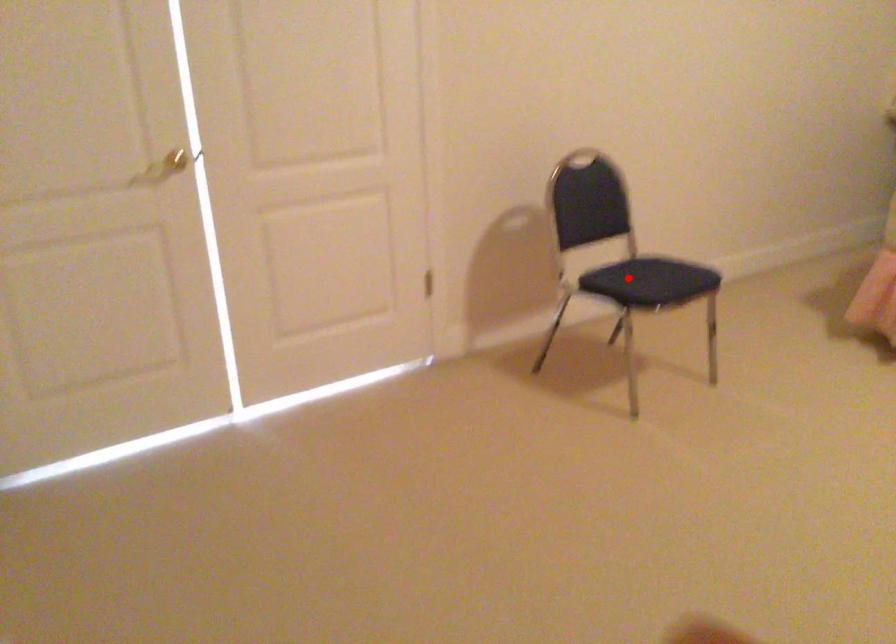
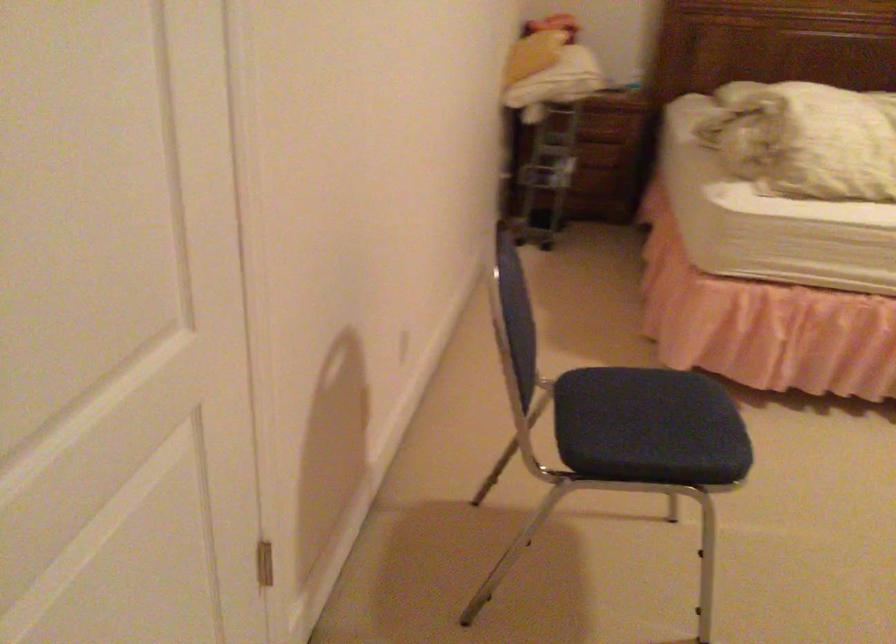
Find the pixel in the second image that matches the highlighted location in the first image.

(650, 433)